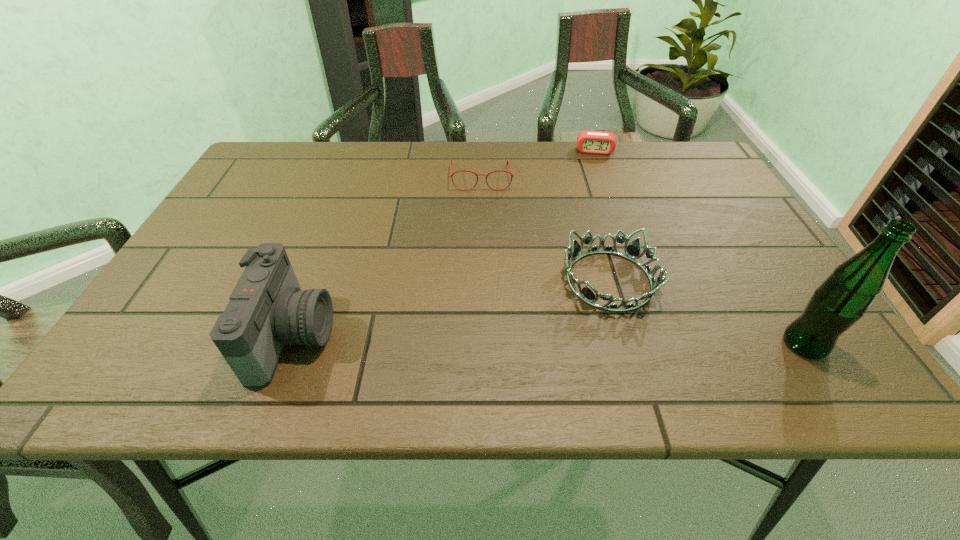
Where is `the leftmost object`? The image size is (960, 540). the leftmost object is located at coordinates (267, 310).

Image resolution: width=960 pixels, height=540 pixels. What are the coordinates of `the fourth shortest object` in the screenshot? It's located at (267, 310).

In order to click on the tallest object in this screenshot , I will do `click(844, 297)`.

The width and height of the screenshot is (960, 540). I want to click on beer bottle, so click(844, 297).

The image size is (960, 540). I want to click on the farthest object, so click(591, 142).

Image resolution: width=960 pixels, height=540 pixels. What are the coordinates of `the third tallest object` in the screenshot? It's located at (632, 251).

Identify the location of the second object from left to right. The width and height of the screenshot is (960, 540). (451, 174).

This screenshot has width=960, height=540. In order to click on spectacles in this screenshot , I will do `click(451, 174)`.

Where is `vacant space located 0.050m at the lens of the leftmost object`? Image resolution: width=960 pixels, height=540 pixels. vacant space located 0.050m at the lens of the leftmost object is located at coordinates (357, 336).

Find the location of a particular element. The height and width of the screenshot is (540, 960). blank area located 0.350m on the left of the rightmost object is located at coordinates (595, 344).